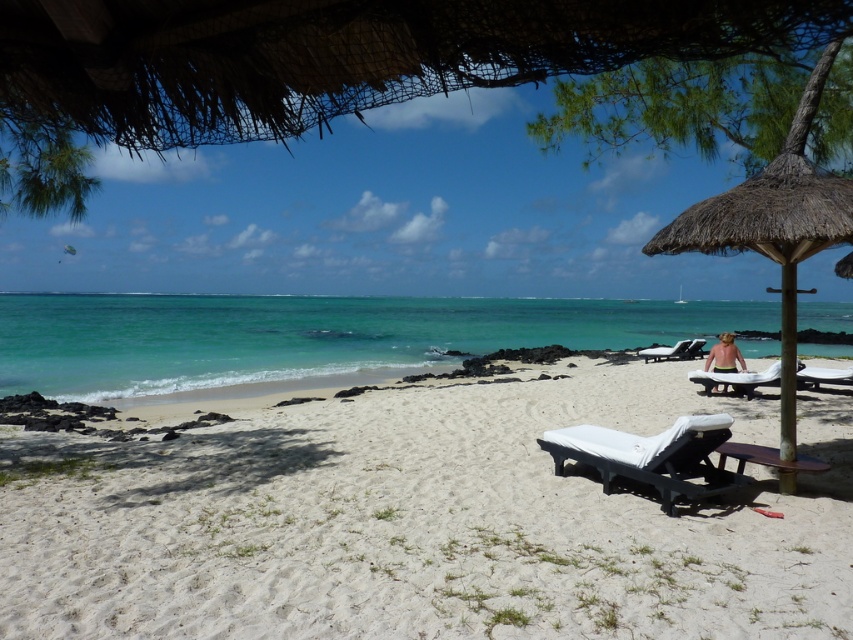
You are standing at the center of the beach scene. Which direction should you walk to reach the thatched straw umbrella at right?

The thatched straw umbrella at right is located at the right side of the scene, so you should walk towards the right direction to reach it.